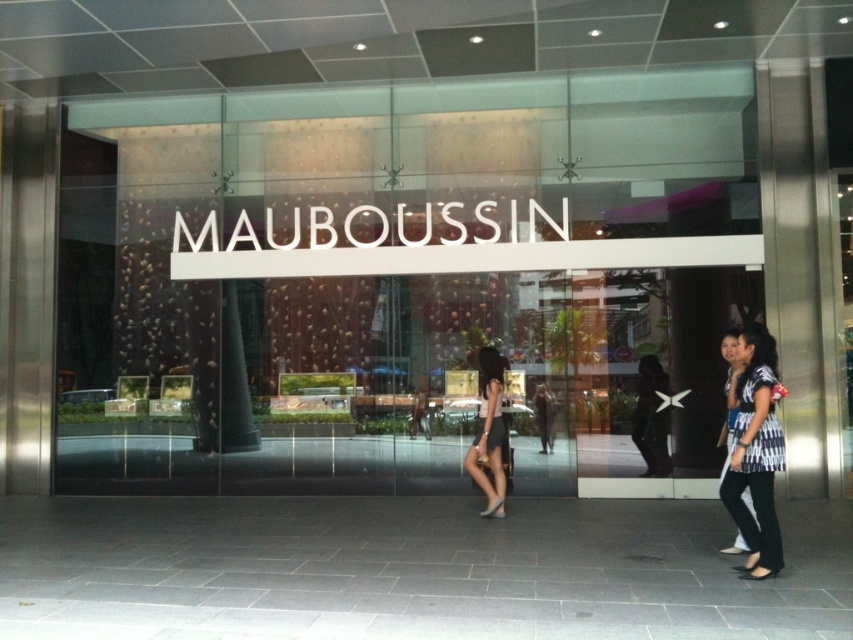
Is the position of striped fabric blouse at right less distant than that of matte white dress at center?

Yes, it is.

Which is more to the left, striped fabric blouse at right or matte white dress at center?

matte white dress at center

Which is in front, point (753, 484) or point (474, 436)?

Point (753, 484)

Identify the location of striped fabric blouse at right. (755, 451).